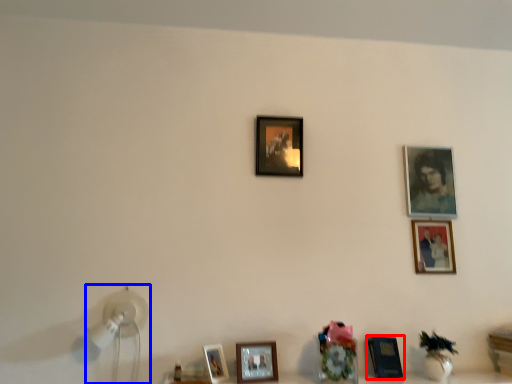
Question: Which of the following is the closest to the observer, picture frame (highlighted by a red box) or table lamp (highlighted by a blue box)?

Choices:
 (A) picture frame
 (B) table lamp

Answer: (B)